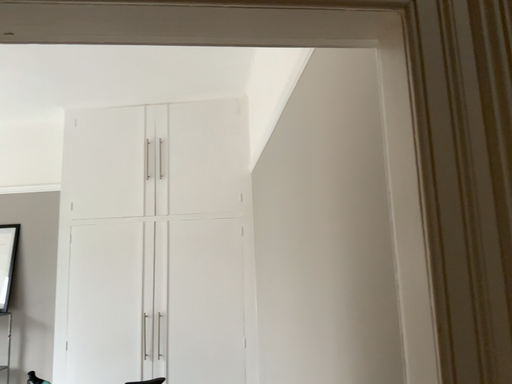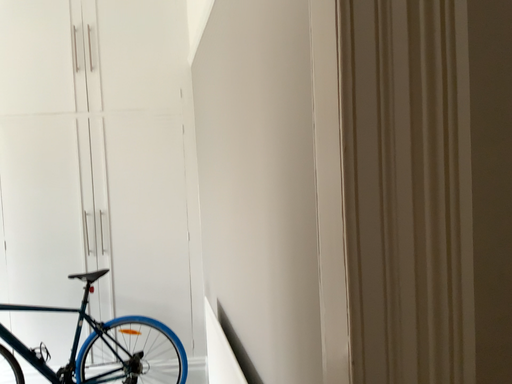
Question: How did the camera likely rotate when shooting the video?

Choices:
 (A) rotated right
 (B) rotated left

Answer: (A)